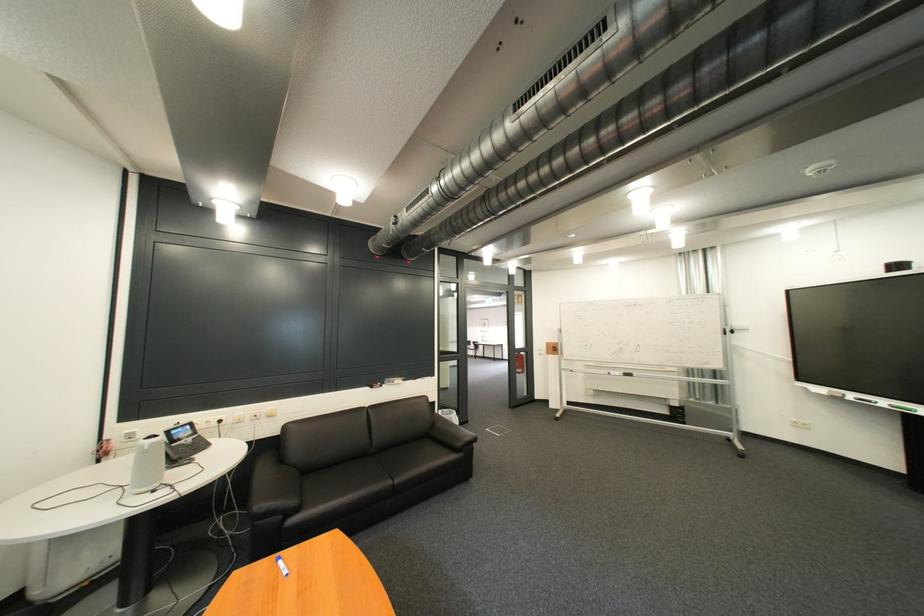
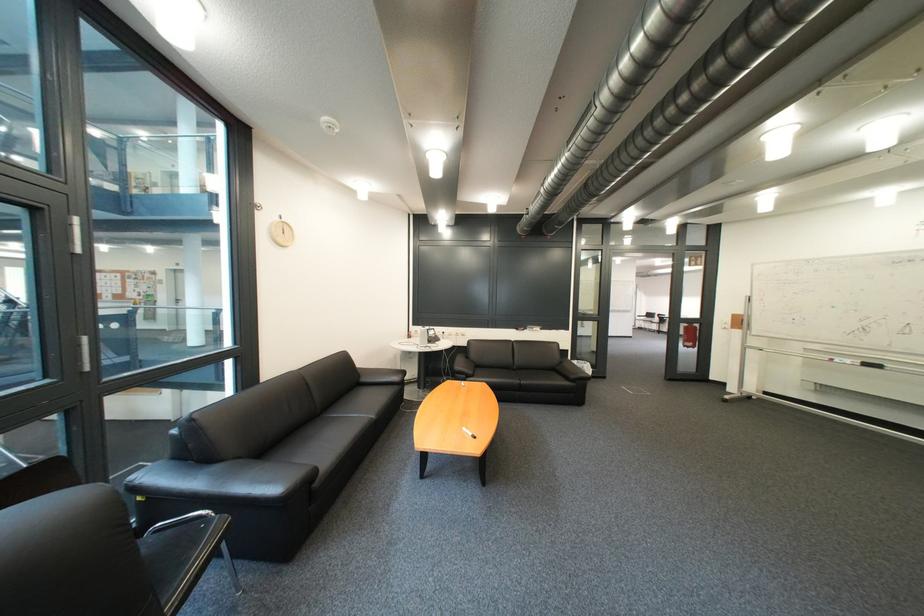
Where in the second image is the point corresponding to [480,424] from the first image?

(618, 379)